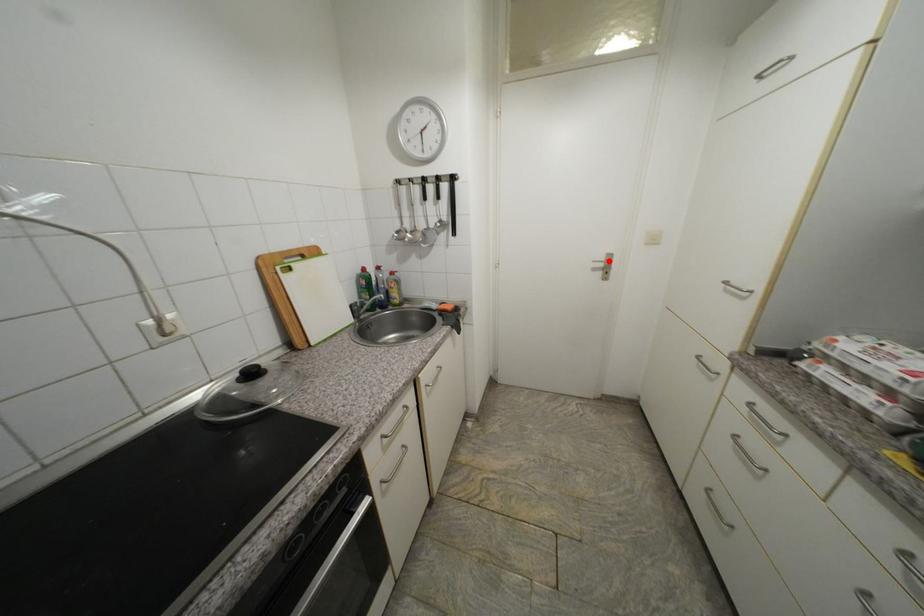
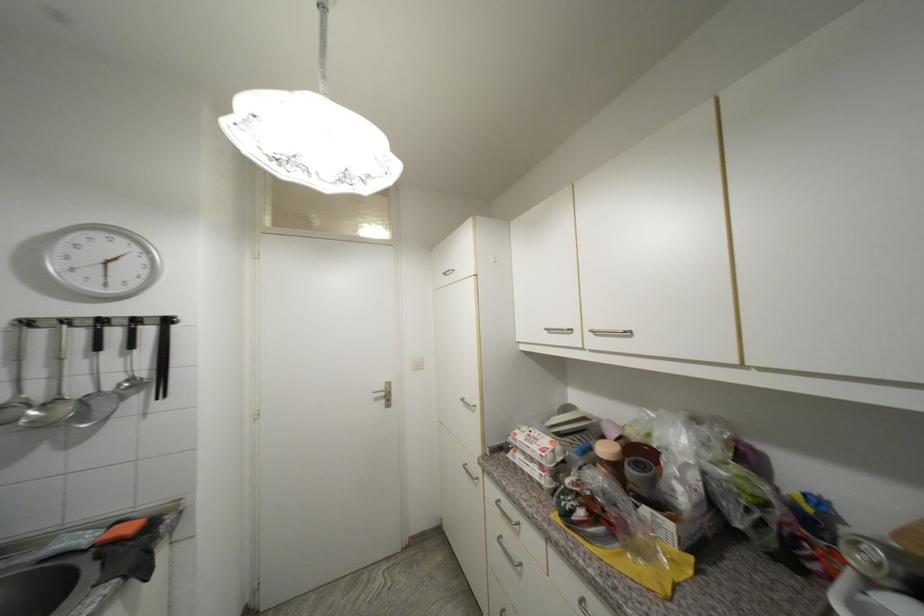
Question: I am providing you with two images of the same scene from different viewpoints. Given a red point in image1, look at the same physical point in image2. Is it:

Choices:
 (A) Closer to the viewpoint
 (B) Farther from the viewpoint

Answer: (B)